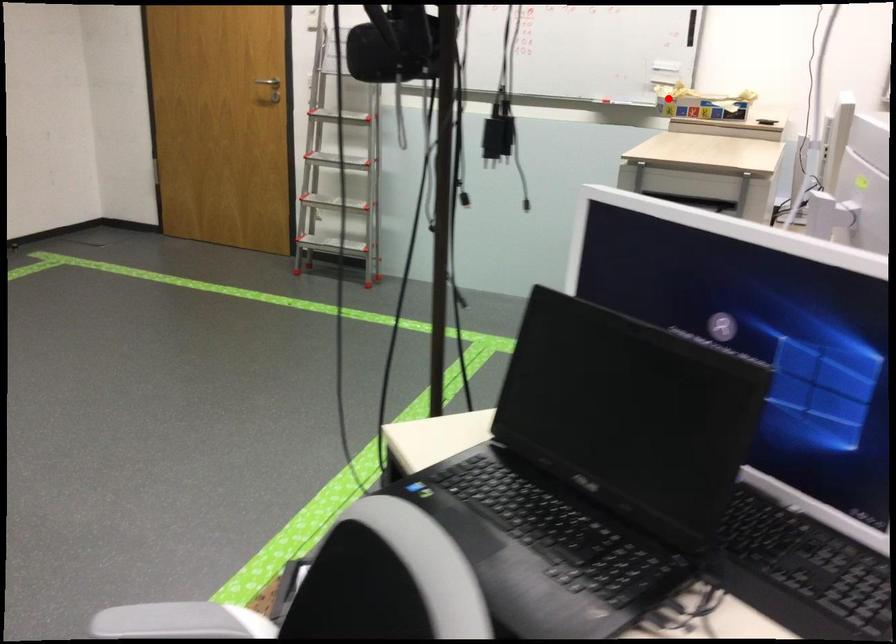
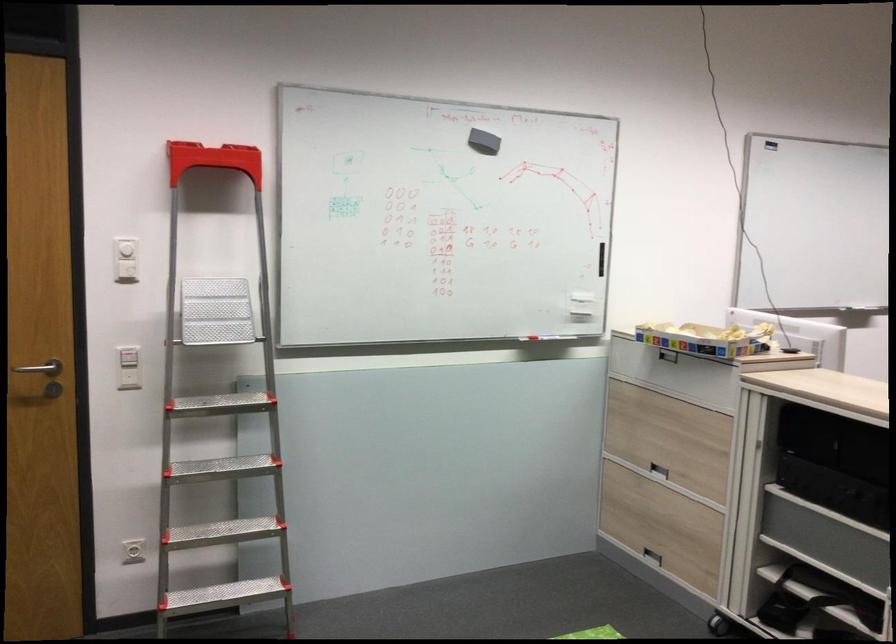
In the second image, find the point that corresponds to the highlighted location in the first image.

(705, 339)